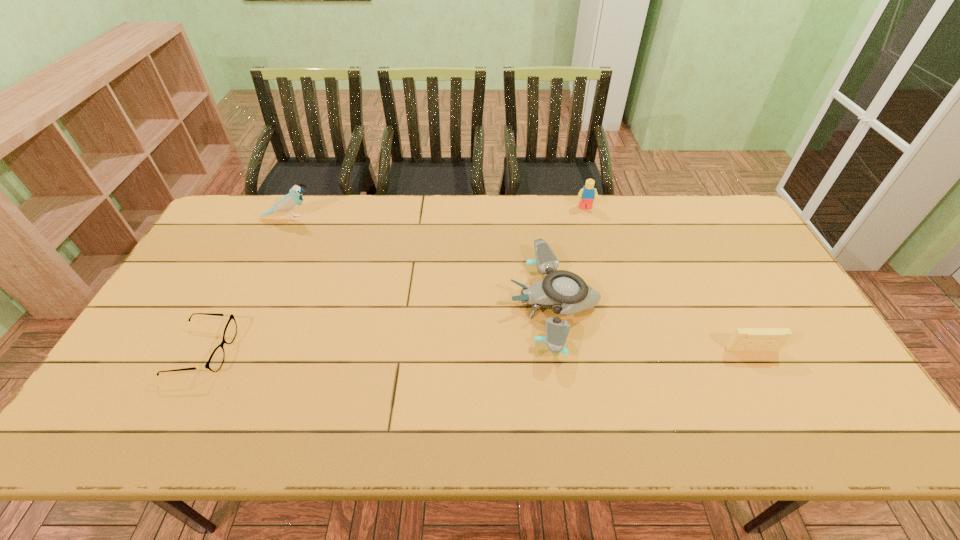
The height and width of the screenshot is (540, 960). I want to click on the tallest object, so click(x=290, y=202).

Locate an element on the screen. The height and width of the screenshot is (540, 960). the fourth nearest object is located at coordinates (290, 202).

You are a GUI agent. You are given a task and a screenshot of the screen. Output one action in this format:
    pyautogui.click(x=<x>, y=<y>)
    Task: Click on the farthest object
    
    Given the screenshot: What is the action you would take?
    pyautogui.click(x=587, y=194)

Identify the location of the second tallest object. (587, 194).

This screenshot has height=540, width=960. In order to click on drone in this screenshot , I will do `click(565, 292)`.

You are a GUI agent. You are given a task and a screenshot of the screen. Output one action in this format:
    pyautogui.click(x=<x>, y=<y>)
    Task: Click on the rightmost object
    The image size is (960, 540).
    Given the screenshot: What is the action you would take?
    pyautogui.click(x=743, y=339)

The width and height of the screenshot is (960, 540). I want to click on the shortest object, so click(x=216, y=359).

Where is `free space located 0.250m at the face of the second farthest object`? free space located 0.250m at the face of the second farthest object is located at coordinates (389, 218).

Image resolution: width=960 pixels, height=540 pixels. Find the location of `vacant space located on the front-facing side of the Lego`. vacant space located on the front-facing side of the Lego is located at coordinates (592, 232).

Locate an element on the screen. The image size is (960, 540). blank space located on the front-facing side of the drone is located at coordinates (444, 304).